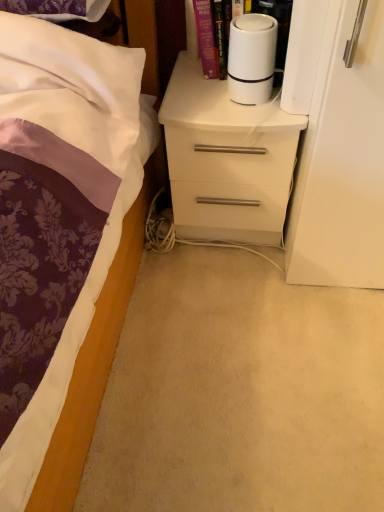
The image size is (384, 512). What are the coordinates of `free space in front of white matte cylindrical device at upper right` in the screenshot? It's located at (229, 109).